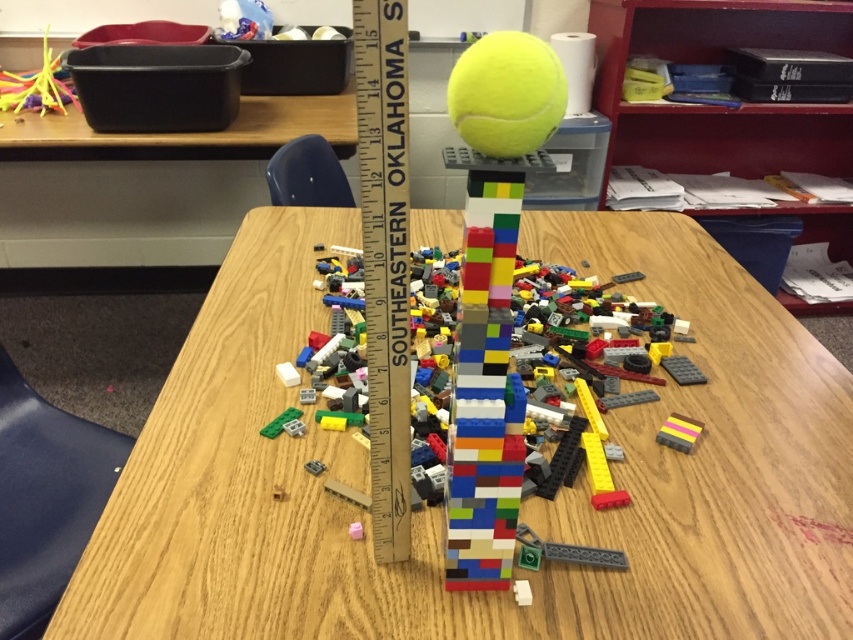
Is multicolored plastic ruler at center to the right of wooden at center from the viewer's perspective?

Correct, you'll find multicolored plastic ruler at center to the right of wooden at center.

Is multicolored plastic ruler at center below wooden at center?

Yes, multicolored plastic ruler at center is below wooden at center.

Where is `multicolored plastic ruler at center`? Image resolution: width=853 pixels, height=640 pixels. multicolored plastic ruler at center is located at coordinates (485, 381).

Where is `multicolored plastic ruler at center`? multicolored plastic ruler at center is located at coordinates (485, 381).

Can you confirm if yellow fuzzy tennis ball at upper center is smaller than translucent yellow straws at upper left?

Indeed, yellow fuzzy tennis ball at upper center has a smaller size compared to translucent yellow straws at upper left.

Which is behind, point (457, 92) or point (45, 48)?

The point (45, 48) is behind.

What are the coordinates of `yellow fuzzy tennis ball at upper center` in the screenshot? It's located at point(506,93).

Looking at this image, can you confirm if wooden table at center is positioned below yellow fuzzy tennis ball at upper center?

Indeed, wooden table at center is positioned under yellow fuzzy tennis ball at upper center.

Is point (746, 637) closer to camera compared to point (486, 148)?

No, (746, 637) is further to viewer.

Between point (381, 576) and point (476, 56), which one is positioned in front?

Positioned in front is point (476, 56).

I want to click on wooden table at center, so click(x=520, y=504).